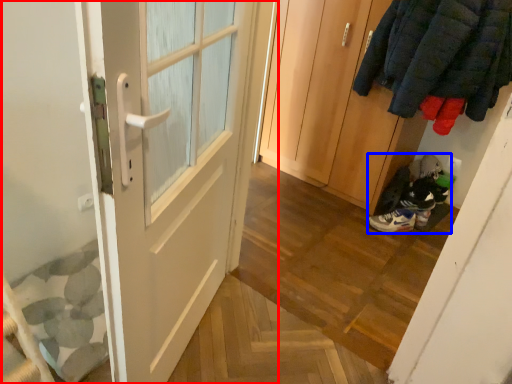
Question: Among these objects, which one is farthest to the camera, door (highlighted by a red box) or footwear (highlighted by a blue box)?

Choices:
 (A) door
 (B) footwear

Answer: (B)